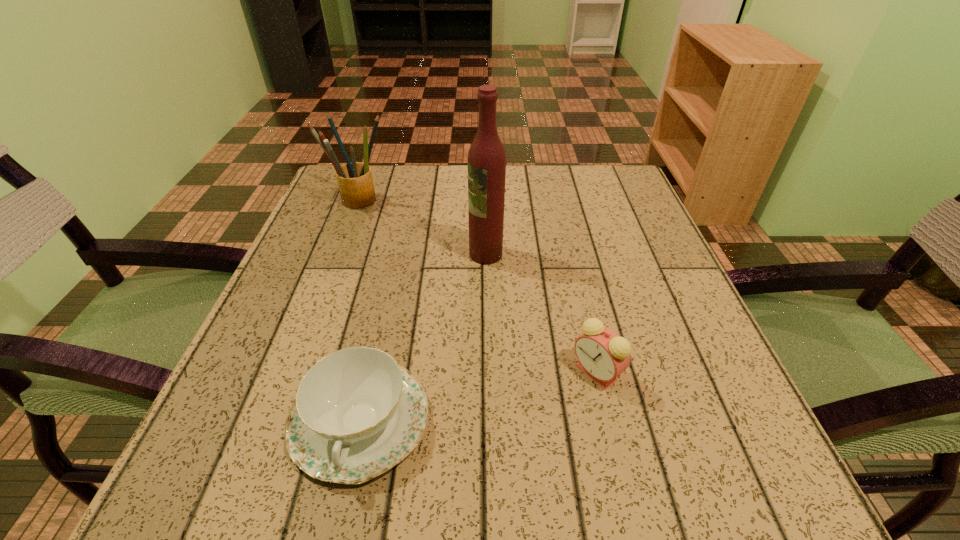
Where is `object that is at the near left corner`? The width and height of the screenshot is (960, 540). object that is at the near left corner is located at coordinates (357, 414).

The width and height of the screenshot is (960, 540). I want to click on vacant area at the far edge, so click(x=440, y=202).

Image resolution: width=960 pixels, height=540 pixels. I want to click on vacant space at the left edge, so click(x=303, y=248).

In the image, there is a desktop. Identify the location of free space at the right edge. Image resolution: width=960 pixels, height=540 pixels. (627, 333).

Find the location of a particular element. The image size is (960, 540). blank space at the far left corner of the desktop is located at coordinates click(349, 210).

Where is `free space at the far right corner of the desktop`? This screenshot has height=540, width=960. free space at the far right corner of the desktop is located at coordinates (578, 199).

At what (x,y) coordinates should I click in order to perform the action: click on free space at the near right corner of the desktop. Please return your answer as a coordinate pair (x, y). The width and height of the screenshot is (960, 540). Looking at the image, I should click on (755, 512).

Where is `vacant space that is in between the farthest object and the rightmost object`? vacant space that is in between the farthest object and the rightmost object is located at coordinates (477, 286).

Find the location of a particular element. empty space that is in between the rightmost object and the pencil box is located at coordinates (477, 286).

At what (x,y) coordinates should I click in order to perform the action: click on vacant space in between the third object from left to right and the alarm clock. Please return your answer as a coordinate pair (x, y). Image resolution: width=960 pixels, height=540 pixels. Looking at the image, I should click on (541, 313).